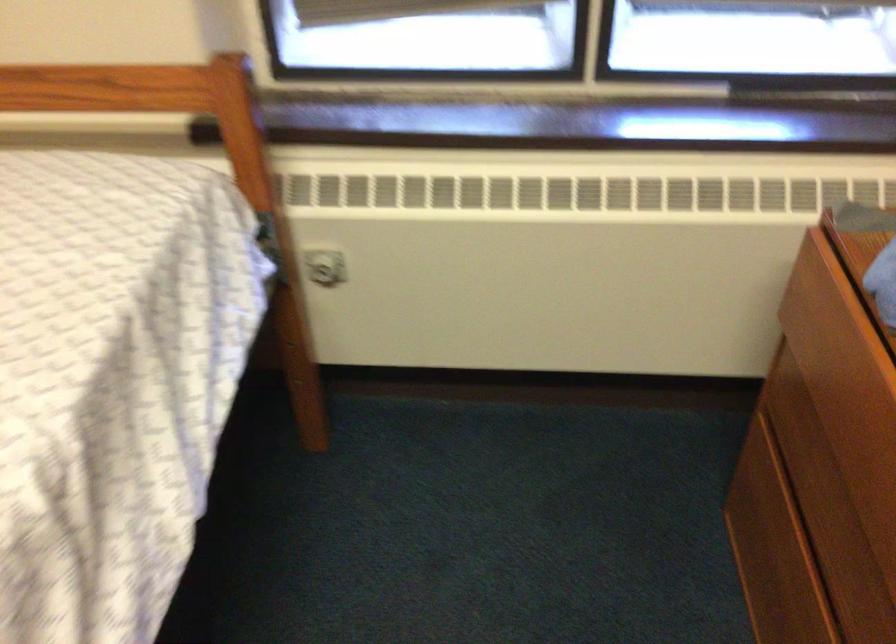
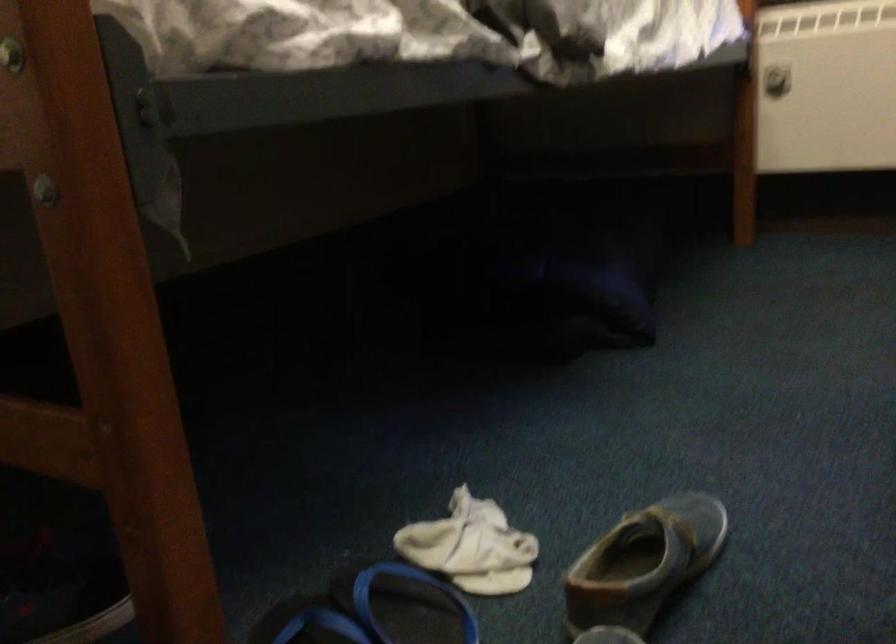
In the second image, find the point that corresponds to point (337, 289) in the first image.

(776, 80)